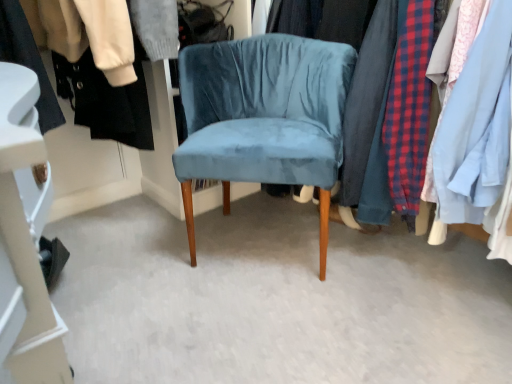
Where is `free space behind black fabric shoe at lower left, positioned as the 2th closet in right-to-left order`? free space behind black fabric shoe at lower left, positioned as the 2th closet in right-to-left order is located at coordinates (98, 231).